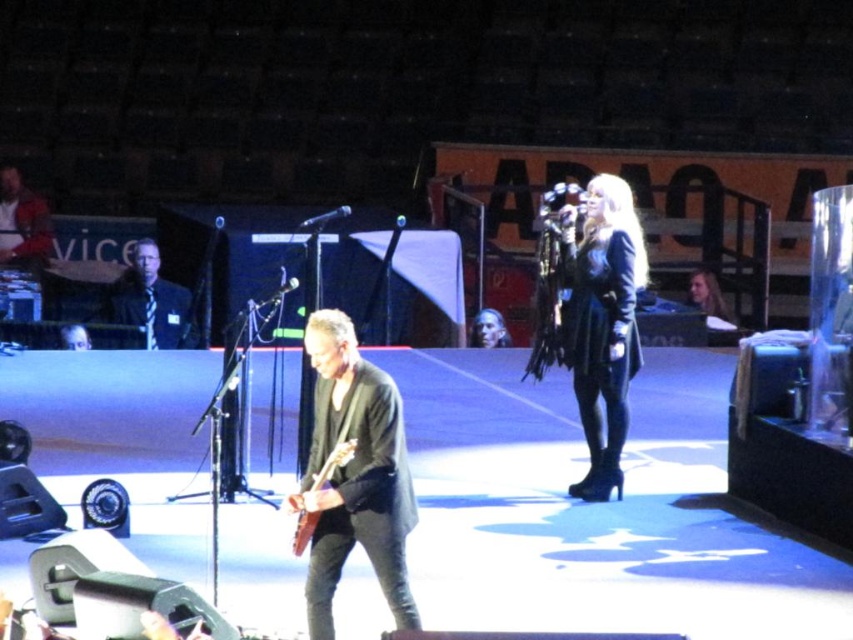
Between black leather jacket at left and wooden electric guitar at center, which one has less height?

With less height is wooden electric guitar at center.

Which is behind, point (146, 273) or point (318, 516)?

Positioned behind is point (146, 273).

Which is in front, point (151, 240) or point (299, 520)?

Point (299, 520) is in front.

In order to click on black leather jacket at left in this screenshot , I will do `click(149, 300)`.

Does point (619, 202) lie in front of point (166, 317)?

That is True.

Can you confirm if black leather jacket at center is positioned below black leather jacket at left?

Correct, black leather jacket at center is located below black leather jacket at left.

Between point (578, 282) and point (148, 344), which one is positioned behind?

The point (148, 344) is behind.

You are a GUI agent. You are given a task and a screenshot of the screen. Output one action in this format:
    pyautogui.click(x=<x>, y=<y>)
    Task: Click on the black leather jacket at center
    The height and width of the screenshot is (640, 853).
    Given the screenshot: What is the action you would take?
    pyautogui.click(x=595, y=321)

Is dark gray leather jacket at center shorter than black leather jacket at left?

Incorrect, dark gray leather jacket at center's height does not fall short of black leather jacket at left's.

Can you confirm if dark gray leather jacket at center is taller than black leather jacket at left?

Indeed, dark gray leather jacket at center has a greater height compared to black leather jacket at left.

Where is `dark gray leather jacket at center`? The image size is (853, 640). dark gray leather jacket at center is located at coordinates (354, 476).